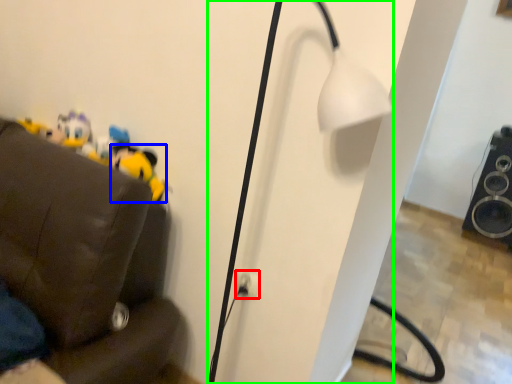
Question: Which object is the closest to the electric outlet (highlighted by a red box)? Choose among these: toy (highlighted by a blue box) or lamp (highlighted by a green box).

Choices:
 (A) toy
 (B) lamp

Answer: (B)